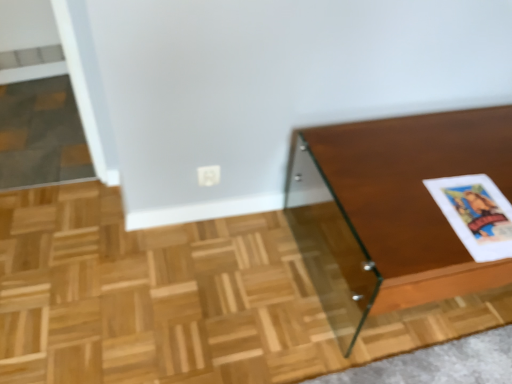
Question: Considering the positions of wooden glossy table at right and white paper at right in the image, is wooden glossy table at right wider or thinner than white paper at right?

Choices:
 (A) wide
 (B) thin

Answer: (A)

Question: Considering the positions of wooden glossy table at right and white paper at right in the image, is wooden glossy table at right taller or shorter than white paper at right?

Choices:
 (A) short
 (B) tall

Answer: (B)

Question: Is wooden glossy table at right inside the boundaries of white paper at right, or outside?

Choices:
 (A) outside
 (B) inside

Answer: (A)

Question: Based on their sizes in the image, would you say white paper at right is bigger or smaller than wooden glossy table at right?

Choices:
 (A) big
 (B) small

Answer: (B)

Question: From the image's perspective, is white paper at right positioned above or below wooden glossy table at right?

Choices:
 (A) above
 (B) below

Answer: (A)

Question: Is point (501, 246) closer or farther from the camera than point (437, 291)?

Choices:
 (A) farther
 (B) closer

Answer: (B)

Question: Is white paper at right situated inside wooden glossy table at right or outside?

Choices:
 (A) inside
 (B) outside

Answer: (A)